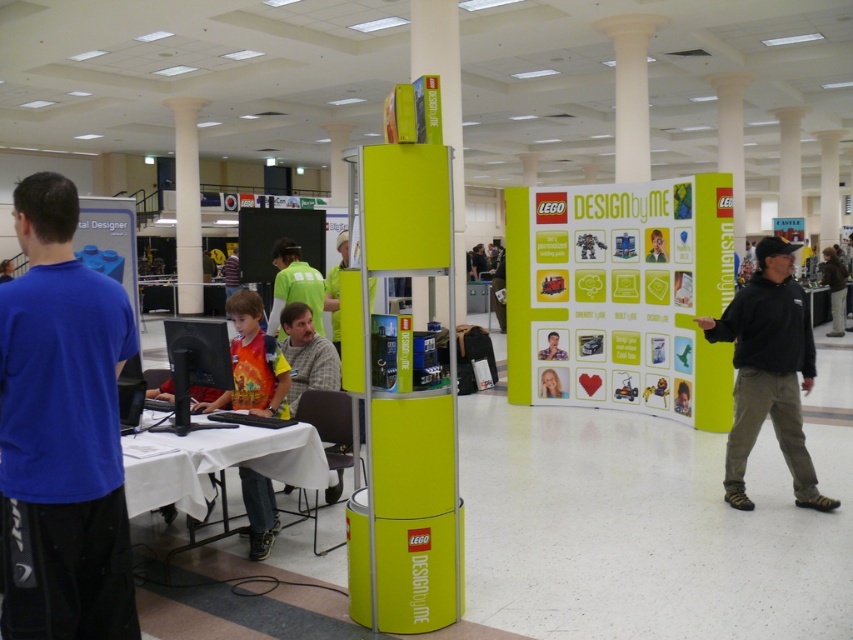
You are a photographer trying to capture a closeup of the smooth plastic face at center and light blue shirt at center. Which object should you zoom in on to ensure it fits entirely within the frame if the camera can only accommodate the smaller object?

The smooth plastic face at center has a smaller width than the light blue shirt at center, so you should zoom in on the smooth plastic face at center to ensure it fits entirely within the frame.

You are standing in the LEGO event space and see two points marked on the floor. The first point is labeled as point (257, 349) and the second is point (236, 269). If you are facing the direction of the LEGO display stand, which point is closer to you?

Point (257, 349) is in front of point (236, 269), so if you are facing the LEGO display stand, point (257, 349) is closer to you.